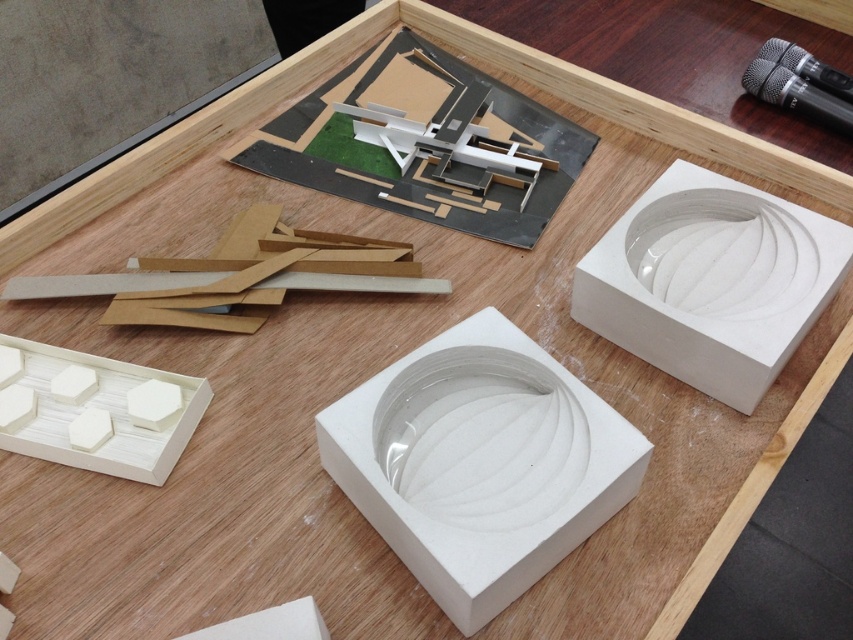
Does white matte box at center appear on the left side of white matte box at center-right?

Correct, you'll find white matte box at center to the left of white matte box at center-right.

Which is behind, point (505, 518) or point (625, 262)?

Point (625, 262)

I want to click on white matte box at center, so click(480, 461).

Is white matte box at center-right positioned in front of white matte hexagon at lower left?

Yes, it is in front of white matte hexagon at lower left.

Is white matte box at center-right below white matte hexagon at lower left?

No.

Find the location of a particular element. The height and width of the screenshot is (640, 853). white matte box at center-right is located at coordinates (711, 282).

Is white matte box at center positioned in front of white matte hexagon at lower left?

Yes, it is in front of white matte hexagon at lower left.

Which is below, white matte box at center or white matte hexagon at lower left?

white matte box at center

Does point (354, 406) come behind point (173, 461)?

No, (354, 406) is in front of (173, 461).

Find the location of a particular element. The image size is (853, 640). white matte box at center is located at coordinates (480, 461).